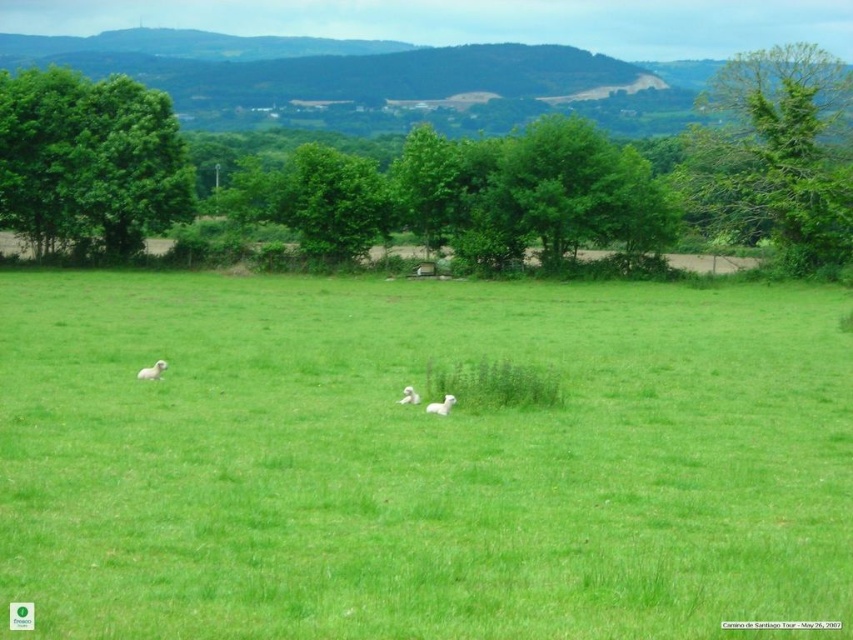
Question: Which point appears closest to the camera in this image?

Choices:
 (A) (346, 156)
 (B) (177, 220)
 (C) (404, 400)
 (D) (158, 362)

Answer: (C)

Question: Can you confirm if green leafy tree at upper right is wider than green leafy tree at upper left?

Choices:
 (A) yes
 (B) no

Answer: (A)

Question: Which point appears farthest from the camera in this image?

Choices:
 (A) (544, 483)
 (B) (413, 396)
 (C) (167, 172)
 (D) (444, 403)

Answer: (C)

Question: Does green leafy tree at upper left appear over white woolly sheep at center?

Choices:
 (A) no
 (B) yes

Answer: (B)

Question: Which of the following is the closest to the observer?

Choices:
 (A) white fluffy sheep at center
 (B) white fluffy sheep at left

Answer: (A)

Question: Is green leafy tree at upper right below white woolly sheep at center?

Choices:
 (A) no
 (B) yes

Answer: (A)